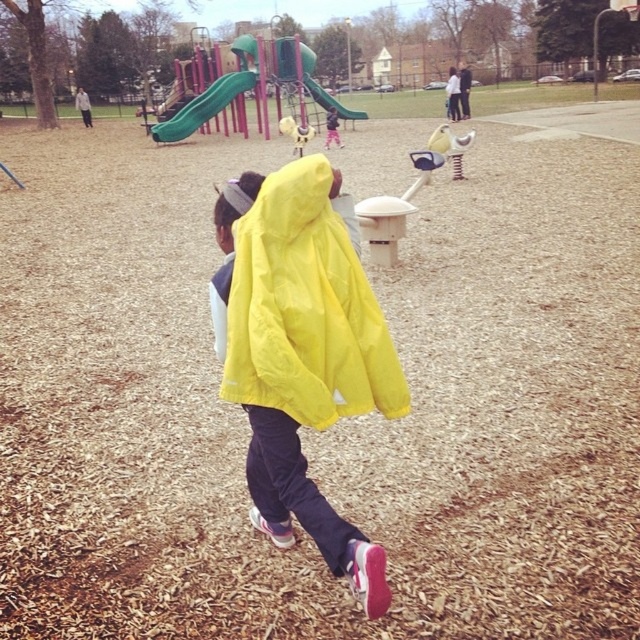
You are standing at the playground and want to place a small toy between the two points labeled as point (304, 200) and point (317, 100). Which point should the toy be closer to if you want it to be nearer to you?

The toy should be placed closer to point (304, 200) because it is closer to the viewer than point (317, 100).

Looking at this image, you are a parent watching your child play at the playground. You see the yellow matte jacket at center and the green plastic slide at upper center. Which object is closer to you?

The yellow matte jacket at center is closer to you because it is in front of the green plastic slide at upper center.

You are a parent trying to decide whether to let your child play on the green rubber slide at upper center while wearing their yellow matte jacket at center. Considering the size difference between the two, is there a risk that the jacket might get caught on the slide?

The yellow matte jacket at center is bigger than the green rubber slide at upper center. This size difference could pose a risk as the larger jacket might get caught or snagged on the slide during use.